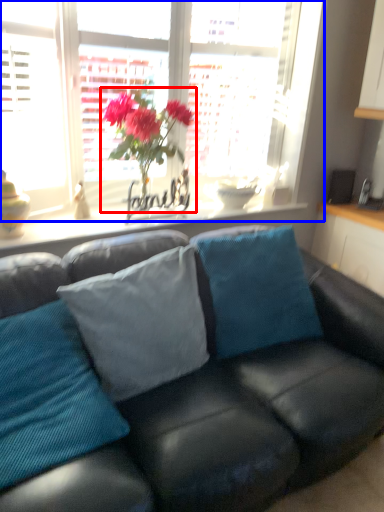
Question: Which of the following is the farthest to the observer, houseplant (highlighted by a red box) or window (highlighted by a blue box)?

Choices:
 (A) houseplant
 (B) window

Answer: (A)